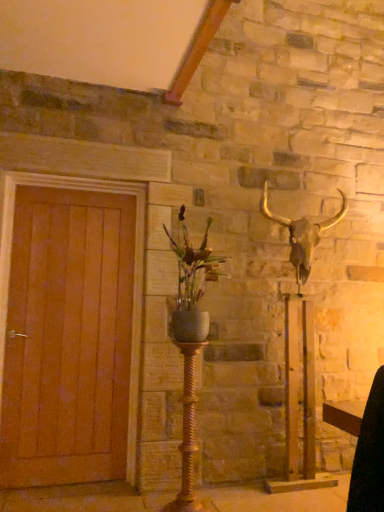
Question: From a real-world perspective, does gold twisted metal candle holder at center sit lower than matte gray vase at center?

Choices:
 (A) yes
 (B) no

Answer: (A)

Question: Considering the relative sizes of gold twisted metal candle holder at center and matte gray vase at center in the image provided, is gold twisted metal candle holder at center smaller than matte gray vase at center?

Choices:
 (A) yes
 (B) no

Answer: (A)

Question: Is gold twisted metal candle holder at center turned away from matte gray vase at center?

Choices:
 (A) no
 (B) yes

Answer: (A)

Question: Are gold twisted metal candle holder at center and matte gray vase at center located far from each other?

Choices:
 (A) no
 (B) yes

Answer: (A)

Question: Is matte gray vase at center located within gold twisted metal candle holder at center?

Choices:
 (A) yes
 (B) no

Answer: (B)

Question: Is gold twisted metal candle holder at center further to camera compared to matte gray vase at center?

Choices:
 (A) no
 (B) yes

Answer: (B)

Question: Considering the relative sizes of matte gray vase at center and metallic gold bull skull at upper right in the image provided, is matte gray vase at center wider than metallic gold bull skull at upper right?

Choices:
 (A) yes
 (B) no

Answer: (A)

Question: From the image's perspective, is matte gray vase at center located above metallic gold bull skull at upper right?

Choices:
 (A) no
 (B) yes

Answer: (B)

Question: Would you say matte gray vase at center is outside metallic gold bull skull at upper right?

Choices:
 (A) yes
 (B) no

Answer: (A)

Question: Does matte gray vase at center appear on the left side of metallic gold bull skull at upper right?

Choices:
 (A) yes
 (B) no

Answer: (A)

Question: Would you say matte gray vase at center is a long distance from metallic gold bull skull at upper right?

Choices:
 (A) yes
 (B) no

Answer: (B)

Question: Could you tell me if matte gray vase at center is facing metallic gold bull skull at upper right?

Choices:
 (A) no
 (B) yes

Answer: (A)

Question: Is metallic gold bull skull at upper right thinner than wooden door at left?

Choices:
 (A) yes
 (B) no

Answer: (B)